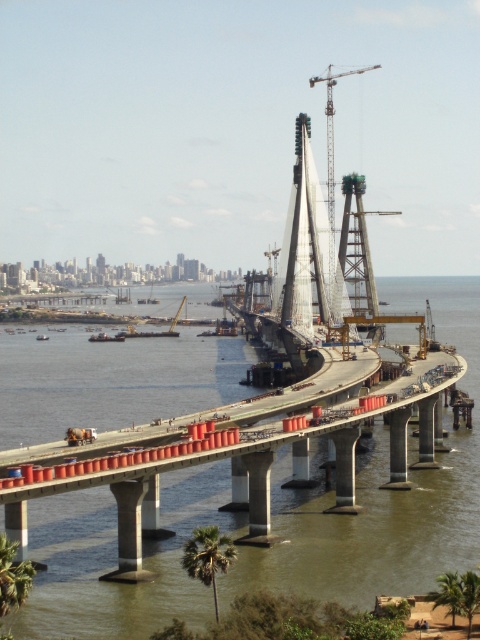
You are an engineer inspecting the bridge construction site. You notice two points marked on the blueprint at coordinates point (x=242, y=362) and point (x=21, y=582). From your vantage point on the construction site, which point is closer to you?

Point (x=21, y=582) is closer to you because the description states that point (x=242, y=362) is behind point (x=21, y=582), meaning the latter is nearer in the line of sight.

You are standing on the partially completed roadway of the bridge under construction. You notice two points marked on the bridge structure. The first point is at coordinates point (195,577) and the second is at point (345,74). If you are facing the direction of the city skyline in the background, which point would be closer to you?

Point (195,577) is in front of point (345,74), so when facing the city skyline, point (195,577) would be closer to you.

You are standing at the green leafy palm tree at lower left and want to cross to the other side of the water. Is the concrete bridge at center the closest structure to you that could help you cross?

The concrete bridge at center is to the right of green leafy palm tree at lower left, so it is the closest structure to you that could help you cross the water.